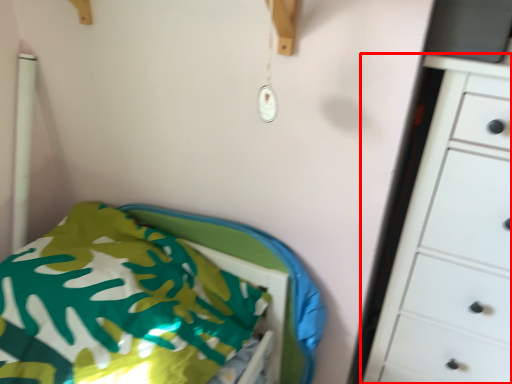
Question: From the image, what is the correct spatial relationship of chest of drawers (annotated by the red box) in relation to furniture?

Choices:
 (A) left
 (B) right

Answer: (B)